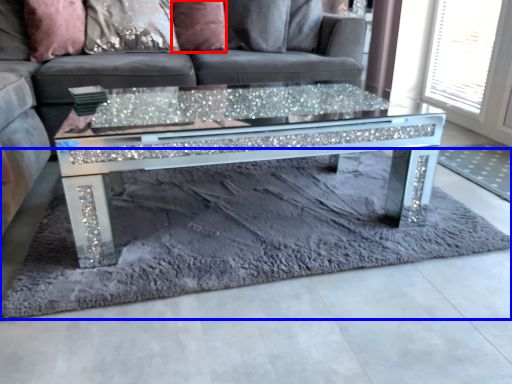
Question: Which of the following is the farthest to the observer, pillow (highlighted by a red box) or mat (highlighted by a blue box)?

Choices:
 (A) pillow
 (B) mat

Answer: (A)